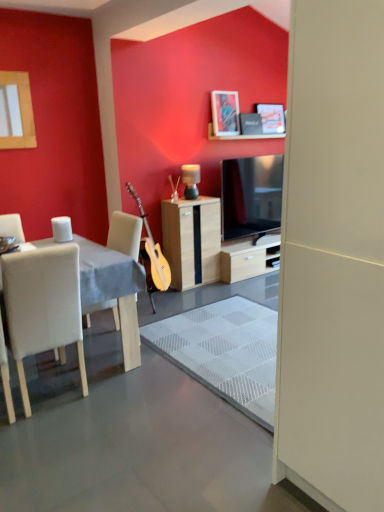
Identify the location of matte black lamp at center. (191, 180).

Describe the element at coordinates (225, 113) in the screenshot. I see `metallic silver picture frame at upper center, which appears as the first picture frame when viewed from the front` at that location.

The width and height of the screenshot is (384, 512). What do you see at coordinates (192, 240) in the screenshot?
I see `wooden cabinet at center` at bounding box center [192, 240].

What do you see at coordinates (43, 306) in the screenshot? This screenshot has width=384, height=512. I see `white leather chair at left` at bounding box center [43, 306].

How much space does matte black picture frame at upper center, positioned as the 1th picture frame in back-to-front order, occupy horizontally?

matte black picture frame at upper center, positioned as the 1th picture frame in back-to-front order, is 4.00 inches wide.

What is the approximate width of white matte screen door at center?

It is 25.46 inches.

You are a GUI agent. You are given a task and a screenshot of the screen. Output one action in this format:
    pyautogui.click(x=<x>, y=<y>)
    Task: Click on the white fabric table at left
    Image resolution: width=384 pixels, height=512 pixels.
    Given the screenshot: What is the action you would take?
    pyautogui.click(x=113, y=290)

Identify the location of matte black lamp at center. (191, 180).

Can you see matte black picture frame at upper center, which ranks as the second picture frame in left-to-right order, touching white leather chair at left?

No, matte black picture frame at upper center, which ranks as the second picture frame in left-to-right order, is not in contact with white leather chair at left.

Does matte black picture frame at upper center, positioned as the 1th picture frame in back-to-front order, have a larger size compared to white leather chair at left?

Actually, matte black picture frame at upper center, positioned as the 1th picture frame in back-to-front order, might be smaller than white leather chair at left.

Between matte black picture frame at upper center, which ranks as the second picture frame in left-to-right order, and white leather chair at left, which one has more height?

With more height is white leather chair at left.

Is matte black picture frame at upper center, marked as the first picture frame in a right-to-left arrangement, turned away from white leather chair at left?

No.

Does matte black lamp at center have a greater height compared to white fabric table at left?

In fact, matte black lamp at center may be shorter than white fabric table at left.

Is white fabric table at left a part of matte black lamp at center?

Actually, white fabric table at left is outside matte black lamp at center.

You are a GUI agent. You are given a task and a screenshot of the screen. Output one action in this format:
    pyautogui.click(x=<x>, y=<y>)
    Task: Click on the desk on the left of matte black lamp at center
    The width and height of the screenshot is (384, 512).
    Given the screenshot: What is the action you would take?
    pyautogui.click(x=113, y=290)

From the image's perspective, relative to white fabric table at left, is matte black lamp at center above or below?

Clearly, from the image's perspective, matte black lamp at center is above white fabric table at left.

From a real-world perspective, which is physically above, matte black picture frame at upper center, which ranks as the second picture frame in left-to-right order, or metallic silver picture frame at upper center, which appears as the first picture frame when viewed from the front?

From a 3D spatial view, metallic silver picture frame at upper center, which appears as the first picture frame when viewed from the front, is above.

Considering the positions of objects matte black picture frame at upper center, marked as the first picture frame in a right-to-left arrangement, and metallic silver picture frame at upper center, the 2th picture frame in the right-to-left sequence, in the image provided, who is in front, matte black picture frame at upper center, marked as the first picture frame in a right-to-left arrangement, or metallic silver picture frame at upper center, the 2th picture frame in the right-to-left sequence,?

Positioned in front is metallic silver picture frame at upper center, the 2th picture frame in the right-to-left sequence.

Considering the sizes of objects white glossy coffee cup at left and matte black picture frame at upper center, positioned as the 1th picture frame in back-to-front order, in the image provided, who is bigger, white glossy coffee cup at left or matte black picture frame at upper center, positioned as the 1th picture frame in back-to-front order,?

matte black picture frame at upper center, positioned as the 1th picture frame in back-to-front order.

Relative to matte black picture frame at upper center, the 2th picture frame viewed from the front, is white glossy coffee cup at left in front or behind?

In the image, white glossy coffee cup at left appears in front of matte black picture frame at upper center, the 2th picture frame viewed from the front.

Are white glossy coffee cup at left and matte black picture frame at upper center, the 2th picture frame viewed from the front, far apart?

white glossy coffee cup at left is positioned a significant distance from matte black picture frame at upper center, the 2th picture frame viewed from the front.

Does point (57, 230) lie behind point (259, 106)?

No, it is not.

Considering the positions of objects wooden cabinet at center and matte black picture frame at upper center, the 2th picture frame viewed from the front, in the image provided, who is in front, wooden cabinet at center or matte black picture frame at upper center, the 2th picture frame viewed from the front,?

wooden cabinet at center.

Is wooden cabinet at center at the left side of matte black picture frame at upper center, marked as the first picture frame in a right-to-left arrangement?

Correct, you'll find wooden cabinet at center to the left of matte black picture frame at upper center, marked as the first picture frame in a right-to-left arrangement.

Is wooden cabinet at center not close to matte black picture frame at upper center, positioned as the 1th picture frame in back-to-front order?

Indeed, wooden cabinet at center is not near matte black picture frame at upper center, positioned as the 1th picture frame in back-to-front order.

From a real-world perspective, between wooden cabinet at center and matte black picture frame at upper center, the 2th picture frame viewed from the front, who is vertically higher?

In real-world perspective, matte black picture frame at upper center, the 2th picture frame viewed from the front, is above.

How different are the orientations of white glossy coffee cup at left and matte black lamp at center in degrees?

There is a 90-degree angle between the facing directions of white glossy coffee cup at left and matte black lamp at center.

Would you say white glossy coffee cup at left is to the left or to the right of matte black lamp at center in the picture?

white glossy coffee cup at left is to the left of matte black lamp at center.

From the image's perspective, does white glossy coffee cup at left appear higher than matte black lamp at center?

Actually, white glossy coffee cup at left appears below matte black lamp at center in the image.

Does white glossy coffee cup at left have a greater width compared to matte black lamp at center?

Incorrect, the width of white glossy coffee cup at left does not surpass that of matte black lamp at center.

Can white glossy coffee cup at left be found inside matte black lamp at center?

No, matte black lamp at center does not contain white glossy coffee cup at left.

Which object is closer to the camera, matte black lamp at center or white glossy coffee cup at left?

white glossy coffee cup at left is in front.

I want to click on lamp above the white glossy coffee cup at left (from the image's perspective), so click(x=191, y=180).

From a real-world perspective, which picture frame is the 1st one above the white leather chair at left? Please provide its 2D coordinates.

[(271, 118)]

Find the location of a particular element. desk on the left of matte black lamp at center is located at coordinates (113, 290).

Which object lies further to the anchor point white fabric table at left, white glossy coffee cup at left or white matte screen door at center?

white matte screen door at center is further to white fabric table at left.

Considering their positions, is matte black lamp at center positioned closer to matte black picture frame at upper center, marked as the first picture frame in a right-to-left arrangement, than wooden cabinet at center?

matte black lamp at center lies closer to matte black picture frame at upper center, marked as the first picture frame in a right-to-left arrangement, than the other object.

When comparing their distances from white matte screen door at center, does white glossy coffee cup at left or matte black picture frame at upper center, which ranks as the second picture frame in left-to-right order, seem further?

matte black picture frame at upper center, which ranks as the second picture frame in left-to-right order, is further to white matte screen door at center.

Considering their positions, is matte black lamp at center positioned closer to wooden cabinet at center than white matte screen door at center?

matte black lamp at center is closer to wooden cabinet at center.

Considering their positions, is wooden cabinet at center positioned further to white matte screen door at center than metallic silver picture frame at upper center, which appears as the first picture frame when viewed from the front?

metallic silver picture frame at upper center, which appears as the first picture frame when viewed from the front, is positioned further to the anchor white matte screen door at center.

Estimate the real-world distances between objects in this image. Which object is further from matte black lamp at center, metallic silver picture frame at upper center, the 2th picture frame in the right-to-left sequence, or white fabric table at left?

white fabric table at left lies further to matte black lamp at center than the other object.

From the image, which object appears to be nearer to matte black picture frame at upper center, which ranks as the second picture frame in left-to-right order, white matte screen door at center or white glossy coffee cup at left?

The object closer to matte black picture frame at upper center, which ranks as the second picture frame in left-to-right order, is white glossy coffee cup at left.

From the picture: Estimate the real-world distances between objects in this image. Which object is further from white glossy coffee cup at left, white fabric table at left or matte black picture frame at upper center, which ranks as the second picture frame in left-to-right order?

matte black picture frame at upper center, which ranks as the second picture frame in left-to-right order, is further to white glossy coffee cup at left.

Where is `chair located between white matte screen door at center and wooden cabinet at center in the depth direction`? chair located between white matte screen door at center and wooden cabinet at center in the depth direction is located at coordinates (43, 306).

Identify the location of cabinetry positioned between white leather chair at left and metallic silver picture frame at upper center, the first picture frame when ordered from left to right, from near to far. This screenshot has width=384, height=512. [192, 240].

Image resolution: width=384 pixels, height=512 pixels. I want to click on coffee cup located between white matte screen door at center and wooden cabinet at center in the depth direction, so click(x=62, y=229).

The width and height of the screenshot is (384, 512). I want to click on coffee cup between white leather chair at left and metallic silver picture frame at upper center, which appears as the first picture frame when viewed from the front, along the z-axis, so click(x=62, y=229).